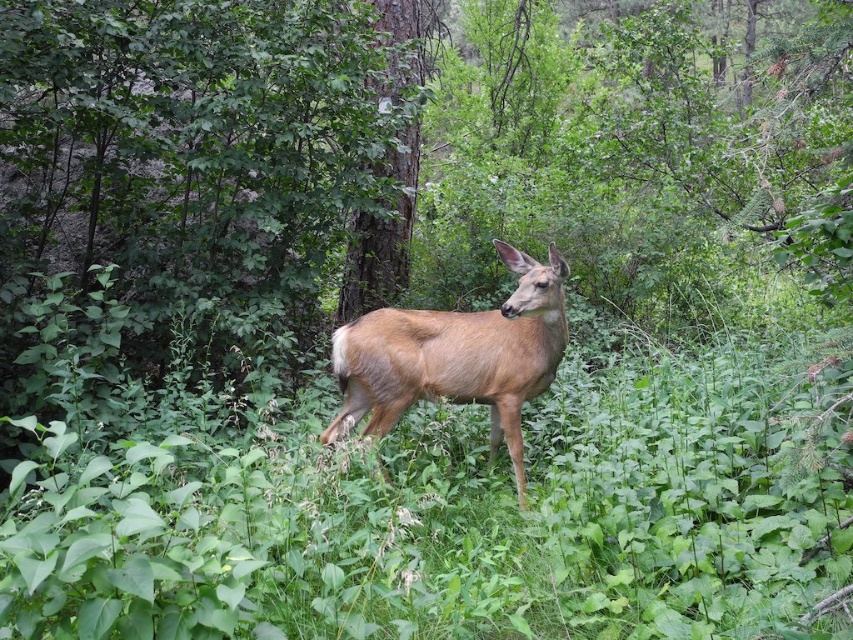
Question: Does green leafy grass at center have a lesser width compared to brown matte deer at center?

Choices:
 (A) no
 (B) yes

Answer: (A)

Question: Is green leafy grass at center bigger than brown matte deer at center?

Choices:
 (A) yes
 (B) no

Answer: (A)

Question: Observing the image, what is the correct spatial positioning of green leafy grass at center in reference to brown matte deer at center?

Choices:
 (A) above
 (B) below

Answer: (B)

Question: Which point is closer to the camera?

Choices:
 (A) [x=352, y=410]
 (B) [x=335, y=580]

Answer: (B)

Question: Which of the following is the farthest from the observer?

Choices:
 (A) brown matte deer at center
 (B) green leafy grass at center

Answer: (A)